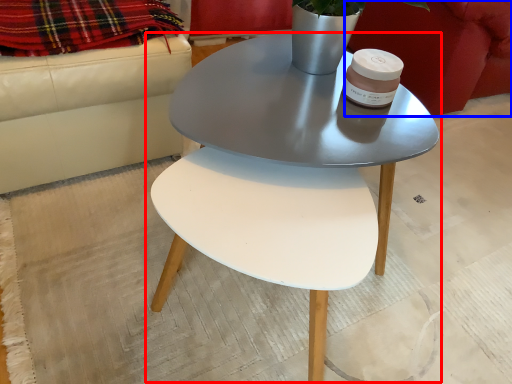
Question: Which object is further to the camera taking this photo, coffee table (highlighted by a red box) or armchair (highlighted by a blue box)?

Choices:
 (A) coffee table
 (B) armchair

Answer: (B)